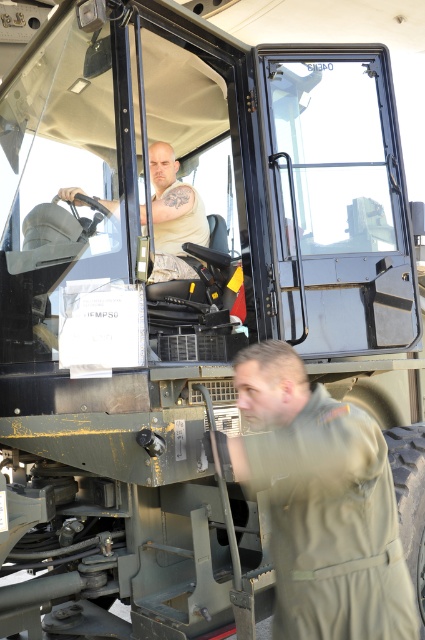
Question: Among these points, which one is nearest to the camera?

Choices:
 (A) (283, 625)
 (B) (175, 220)

Answer: (A)

Question: Is olive green uniform at lower right further to the viewer compared to matte khaki uniform at center?

Choices:
 (A) no
 (B) yes

Answer: (A)

Question: Which point appears closest to the camera in this image?

Choices:
 (A) (207, 228)
 (B) (320, 483)

Answer: (B)

Question: Can you confirm if olive green uniform at lower right is thinner than matte khaki uniform at center?

Choices:
 (A) yes
 (B) no

Answer: (B)

Question: Can you confirm if olive green uniform at lower right is thinner than matte khaki uniform at center?

Choices:
 (A) yes
 (B) no

Answer: (B)

Question: Which point is farther from the camera taking this photo?

Choices:
 (A) (68, 193)
 (B) (272, 346)

Answer: (A)